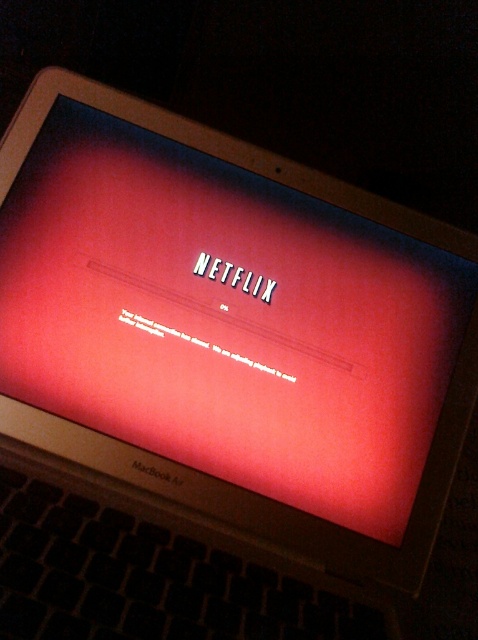
In the scene shown: You are trying to watch a movie on Netflix but see the error message. If you want to focus on the matte plastic computer screen at center and the matte plastic netflix logo at center, which one would appear larger in your view?

The matte plastic computer screen at center is closer to the viewer than the matte plastic netflix logo at center, so it would appear larger in your view.

You are trying to watch a movie on Netflix but see the error message. You want to cover the entire matte plastic netflix logo at center with your hand. Can you do this without covering any part of the matte plastic computer screen at center?

The matte plastic computer screen at center is larger in size than the matte plastic netflix logo at center, so yes, you can cover the entire matte plastic netflix logo at center with your hand without covering any part of the matte plastic computer screen at center.

You are sitting in a dark room and looking at the matte plastic computer screen at center and the matte plastic netflix logo at center. Which object is positioned to the left side of the other one?

The matte plastic computer screen at center is positioned to the left of the matte plastic netflix logo at center.